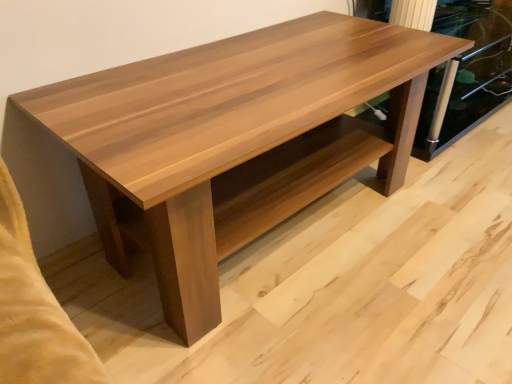
In the scene shown: Measure the distance between transparent glass door at upper right and camera.

The distance of transparent glass door at upper right from camera is 4.92 feet.

This screenshot has height=384, width=512. What are the coordinates of `transparent glass door at upper right` in the screenshot? It's located at (466, 74).

What do you see at coordinates (466, 74) in the screenshot? This screenshot has width=512, height=384. I see `transparent glass door at upper right` at bounding box center [466, 74].

Identify the location of transparent glass door at upper right. This screenshot has height=384, width=512. (466, 74).